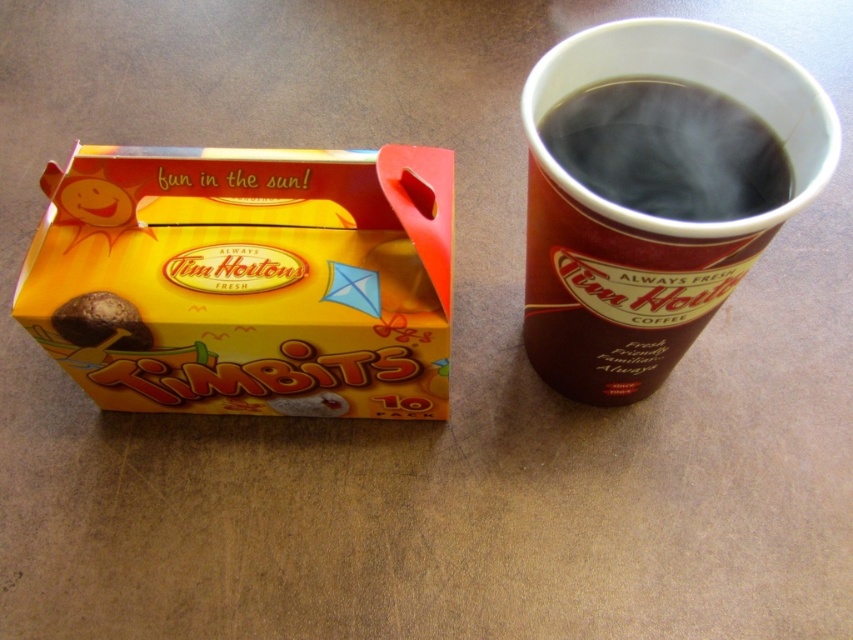
Consider the image. You are standing at the center of the image and want to place a new object exactly halfway between the yellow cardboard box at upper left and the point at point (247,280). Where should you place it?

The yellow cardboard box at upper left is located at point (247,280), so placing the new object halfway between them would require calculating the midpoint between the same coordinate, which is the same point. Therefore, the new object should be placed at point (247,280).

You are looking at the Tim Hortons Timbits box and two points marked on the image. Which point, point [292,257] or point [132,339], is closer to you?

Point [292,257] is closer to the viewer than point [132,339].